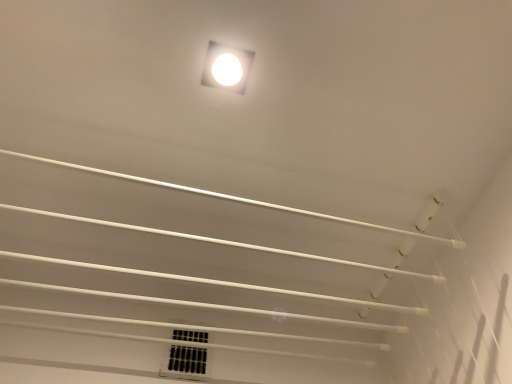
Question: Is white glossy square at upper center turned away from white plastic vent at lower center?

Choices:
 (A) yes
 (B) no

Answer: (B)

Question: Considering the relative sizes of white glossy square at upper center and white plastic vent at lower center in the image provided, is white glossy square at upper center taller than white plastic vent at lower center?

Choices:
 (A) yes
 (B) no

Answer: (B)

Question: From a real-world perspective, is white glossy square at upper center below white plastic vent at lower center?

Choices:
 (A) yes
 (B) no

Answer: (B)

Question: Is white glossy square at upper center to the left of white plastic vent at lower center from the viewer's perspective?

Choices:
 (A) no
 (B) yes

Answer: (A)

Question: Is white glossy square at upper center outside white plastic vent at lower center?

Choices:
 (A) no
 (B) yes

Answer: (B)

Question: Could you tell me if white glossy square at upper center is turned towards white plastic vent at lower center?

Choices:
 (A) yes
 (B) no

Answer: (B)

Question: Is white plastic vent at lower center facing away from white glossy square at upper center?

Choices:
 (A) no
 (B) yes

Answer: (A)

Question: Does white plastic vent at lower center come behind white glossy square at upper center?

Choices:
 (A) yes
 (B) no

Answer: (A)

Question: Can you confirm if white plastic vent at lower center is shorter than white glossy square at upper center?

Choices:
 (A) no
 (B) yes

Answer: (A)

Question: Considering the relative sizes of white plastic vent at lower center and white glossy square at upper center in the image provided, is white plastic vent at lower center bigger than white glossy square at upper center?

Choices:
 (A) no
 (B) yes

Answer: (B)

Question: From the image's perspective, is white plastic vent at lower center under white glossy square at upper center?

Choices:
 (A) no
 (B) yes

Answer: (B)

Question: Can you confirm if white plastic vent at lower center is taller than white glossy square at upper center?

Choices:
 (A) yes
 (B) no

Answer: (A)

Question: Does point tap(228, 84) appear closer or farther from the camera than point tap(170, 349)?

Choices:
 (A) farther
 (B) closer

Answer: (B)